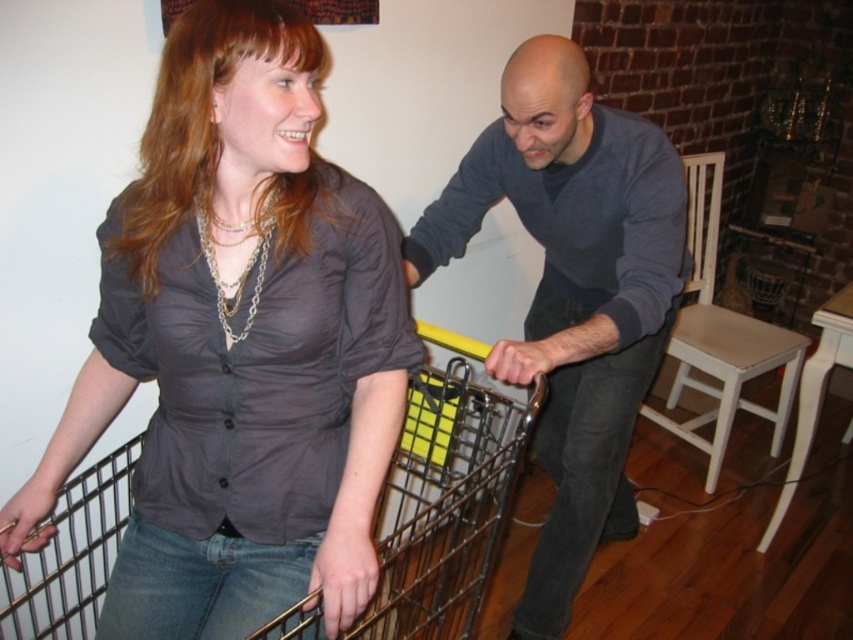
Where is the matte gray sweater at center located in the image?

The matte gray sweater at center is located at point (x=572, y=292).

You are standing in a room and see the matte gray shirt at center and the metallic wire trolley at center. Which object is nearer to you?

The matte gray shirt at center is closer to the viewer than the metallic wire trolley at center.

You are trying to decide which clothing item to wear for a casual day out. You have the matte gray shirt at center and the matte gray sweater at center. Based on their sizes, which one would you choose if you want something more formfitting?

The matte gray shirt at center has a smaller width than the matte gray sweater at center, so it would be more formfitting and suitable for a casual day out.